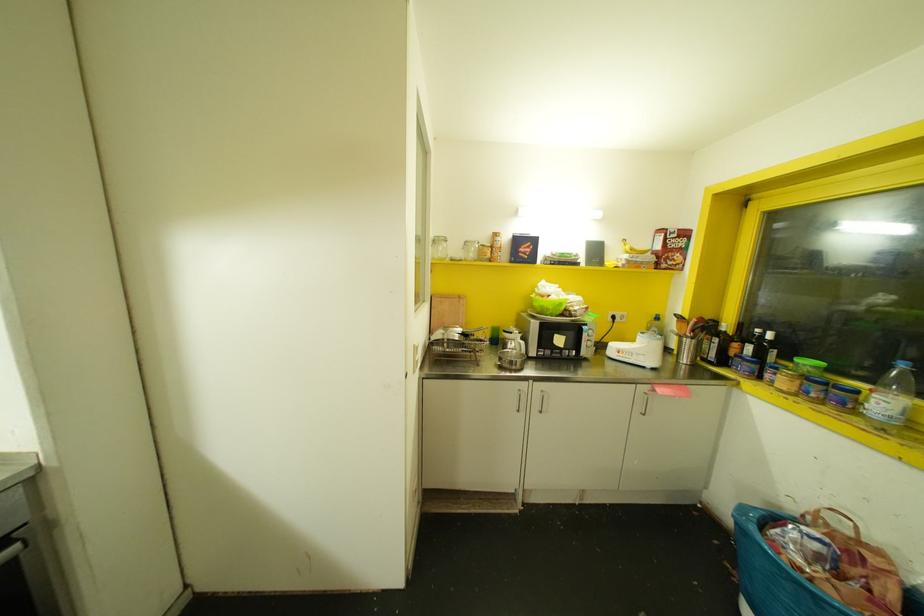
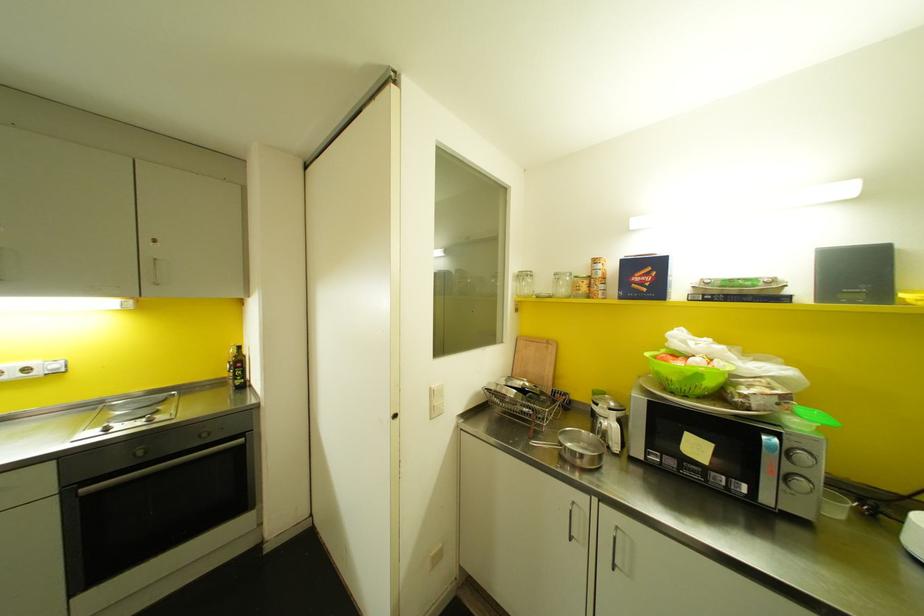
Question: The camera is either moving clockwise (left) or counter-clockwise (right) around the object. The first image is from the beginning of the video and the second image is from the end. Is the camera moving left or right when shooting the video?

Choices:
 (A) Left
 (B) Right

Answer: (B)